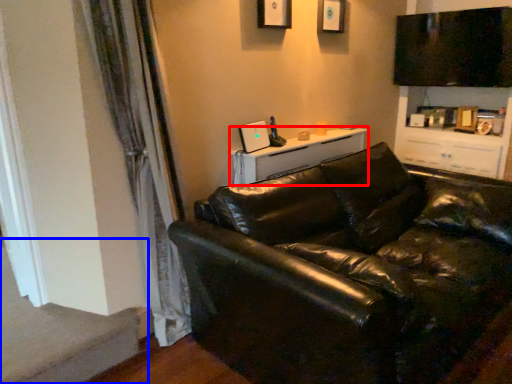
Question: Which object is further to the camera taking this photo, table (highlighted by a red box) or stairwell (highlighted by a blue box)?

Choices:
 (A) table
 (B) stairwell

Answer: (A)